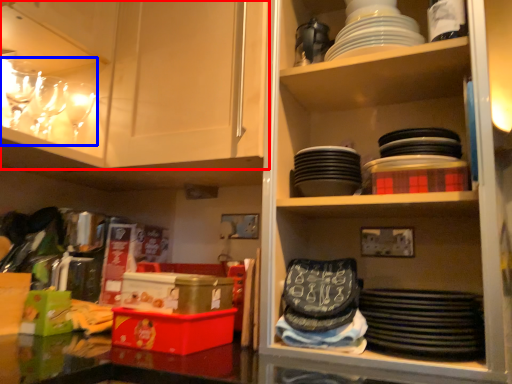
Question: Which object is closer to the camera taking this photo, cabinetry (highlighted by a red box) or tableware (highlighted by a blue box)?

Choices:
 (A) cabinetry
 (B) tableware

Answer: (A)